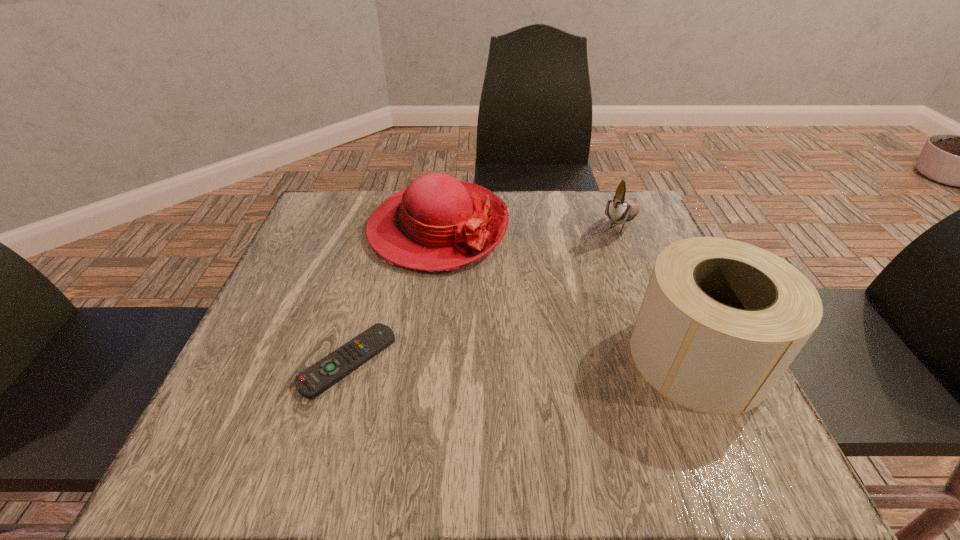
Find the location of a particular element. The width and height of the screenshot is (960, 540). the shortest object is located at coordinates (316, 379).

Where is `toilet tissue`? This screenshot has width=960, height=540. toilet tissue is located at coordinates (721, 320).

You are a GUI agent. You are given a task and a screenshot of the screen. Output one action in this format:
    pyautogui.click(x=<x>, y=<y>)
    Task: Click on the hat
    This screenshot has width=960, height=540.
    Given the screenshot: What is the action you would take?
    pyautogui.click(x=437, y=223)

What are the coordinates of `bird` in the screenshot? It's located at click(x=619, y=210).

Where is `vacant area situated 0.310m on the back of the shortest object`? The height and width of the screenshot is (540, 960). vacant area situated 0.310m on the back of the shortest object is located at coordinates (383, 235).

Where is `vacant point located on the back of the toilet tissue`? vacant point located on the back of the toilet tissue is located at coordinates pyautogui.click(x=655, y=263).

Locate an element on the screen. This screenshot has width=960, height=540. vacant position located at the front of the hat with a bow is located at coordinates (507, 294).

Locate an element on the screen. The width and height of the screenshot is (960, 540). free space located at the front of the hat with a bow is located at coordinates (524, 311).

Find the location of a particular element. This screenshot has height=540, width=960. free space located at the front of the hat with a bow is located at coordinates coord(513,300).

Locate an element on the screen. This screenshot has width=960, height=540. vacant region located at the face of the bird is located at coordinates (569, 318).